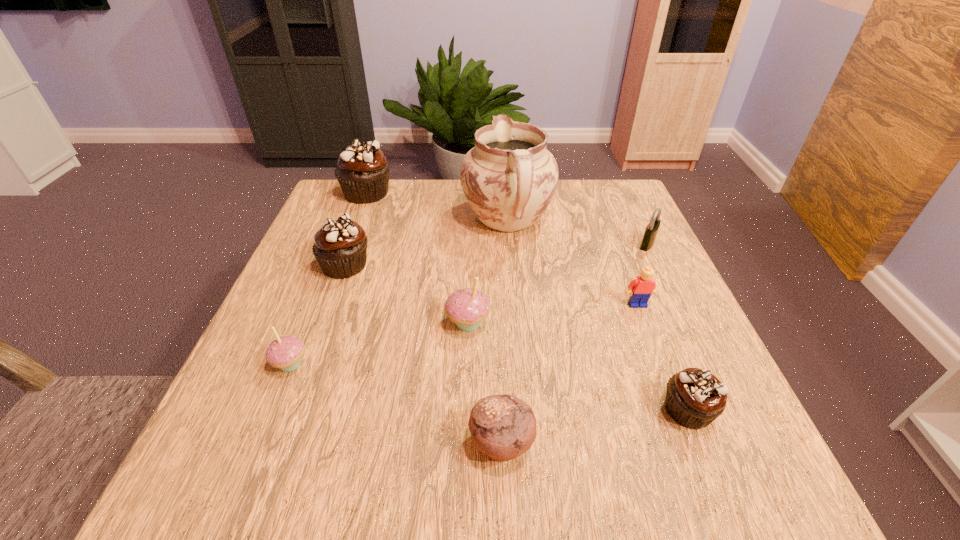
I want to click on vacant space that is in between the Lego and the second smallest brown cupcake, so click(x=492, y=285).

Locate an element on the screen. free space between the farthest brown cupcake and the rightmost cupcake is located at coordinates (527, 302).

Locate an element on the screen. unoccupied position between the nearest cupcake and the biggest brown cupcake is located at coordinates pos(527,302).

You are a GUI agent. You are given a task and a screenshot of the screen. Output one action in this format:
    pyautogui.click(x=<x>, y=<y>)
    Task: Click on the empty space between the black padlock and the nearest brown cupcake
    The image size is (960, 540).
    Given the screenshot: What is the action you would take?
    pyautogui.click(x=668, y=327)

Locate an element on the screen. The width and height of the screenshot is (960, 540). object that is the third closest to the right pink cupcake is located at coordinates (340, 247).

This screenshot has height=540, width=960. I want to click on object that is the third closest to the padlock, so click(695, 398).

Identify which cupcake is located as the second nearest to the left pink cupcake. Please provide its 2D coordinates. Your answer should be formatted as a tuple, i.e. [(x, y)], where the tuple contains the x and y coordinates of a point satisfying the conditions above.

[(467, 307)]

Image resolution: width=960 pixels, height=540 pixels. Identify the location of the closest cupcake to the rightmost cupcake. (467, 307).

Locate which brown cupcake is the closest to the padlock. Please provide its 2D coordinates. Your answer should be formatted as a tuple, i.e. [(x, y)], where the tuple contains the x and y coordinates of a point satisfying the conditions above.

[(695, 398)]

This screenshot has width=960, height=540. Identify the location of the third closest brown cupcake to the third nearest cupcake. (363, 170).